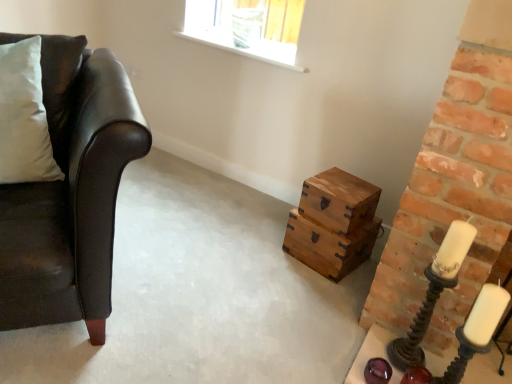
The image size is (512, 384). In order to click on free space between matte black leather couch at left and matte black candle holder at right, the 1th candle holder in the right-to-left sequence in this screenshot , I will do `click(216, 309)`.